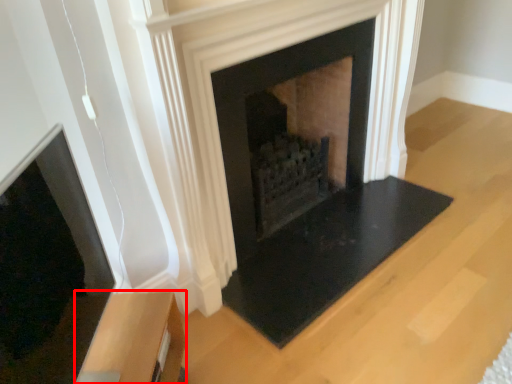
Question: From the image's perspective, where is furniture (annotated by the red box) located relative to fireplace?

Choices:
 (A) below
 (B) above

Answer: (A)